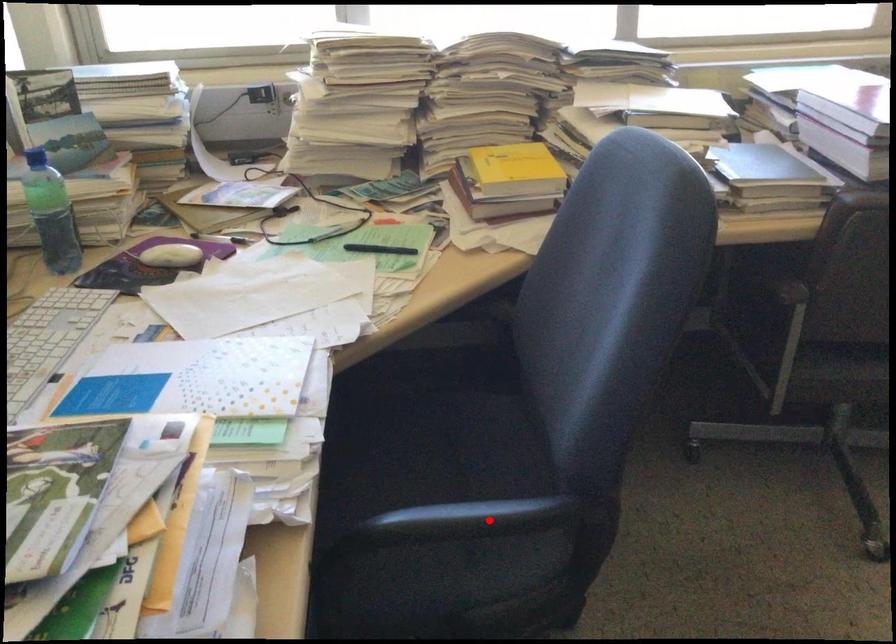
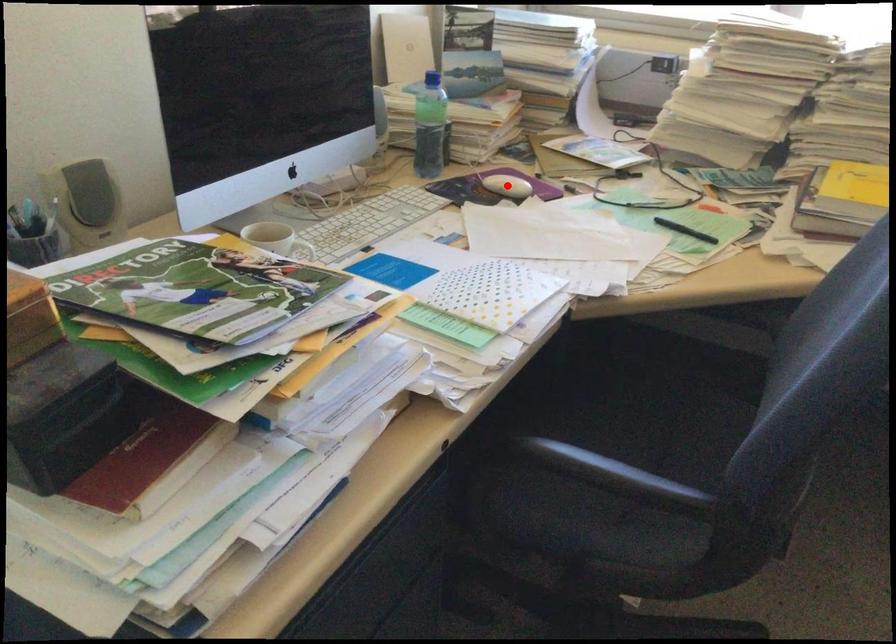
I am providing you with two images of the same scene from different viewpoints. A red point is marked on the first image and another point is marked on the second image. Do the highlighted points in image1 and image2 indicate the same real-world spot?

No